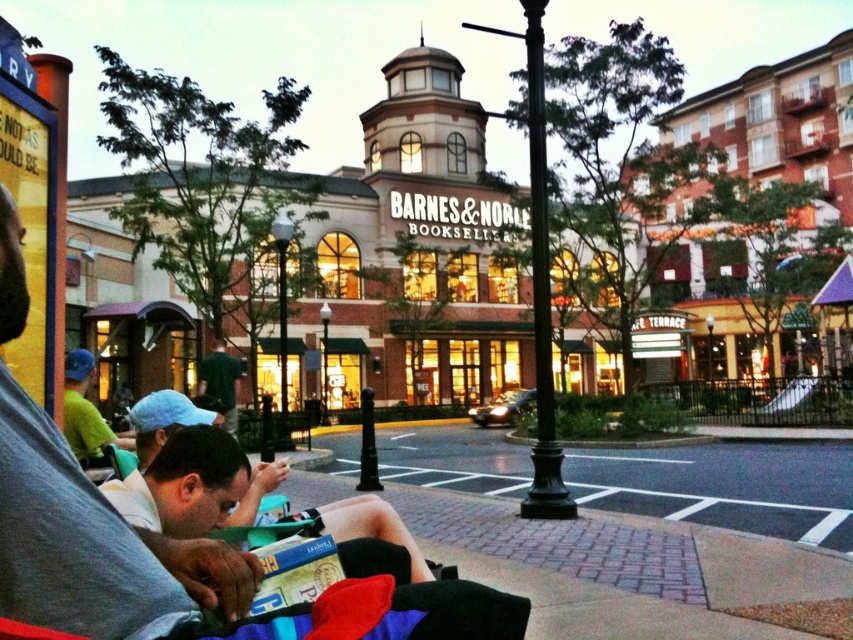
You are standing in front of the Barnes and Noble bookstore and see a person wearing a gray cotton shirt at lower left and another wearing a dark green shirt at center. Which shirt is positioned to the right of the other?

The gray cotton shirt at lower left is positioned to the right of the dark green shirt at center.

You are a photographer standing in front of the brick building at center and the green fabric shirt at left. You want to capture both in a single frame. Which object should you focus on first to ensure both are in focus?

The brick building at center is larger than the green fabric shirt at left, so you should focus on the brick building at center first to ensure both are in focus.